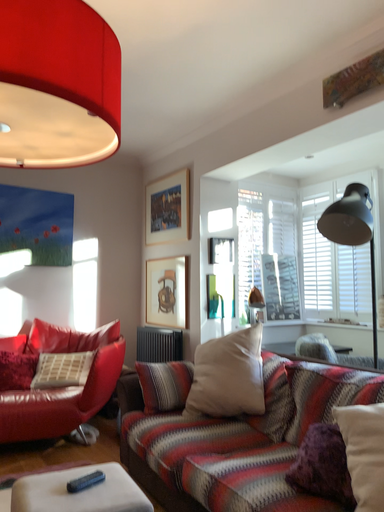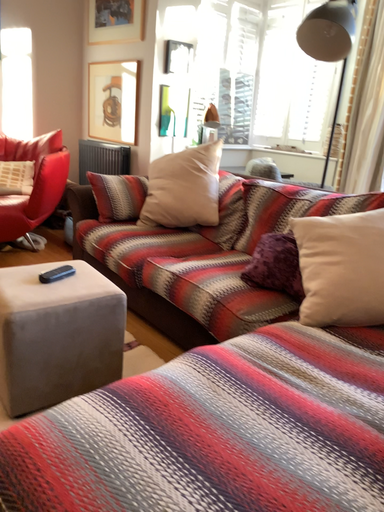
Question: Which way did the camera rotate in the video?

Choices:
 (A) rotated left
 (B) rotated right

Answer: (B)